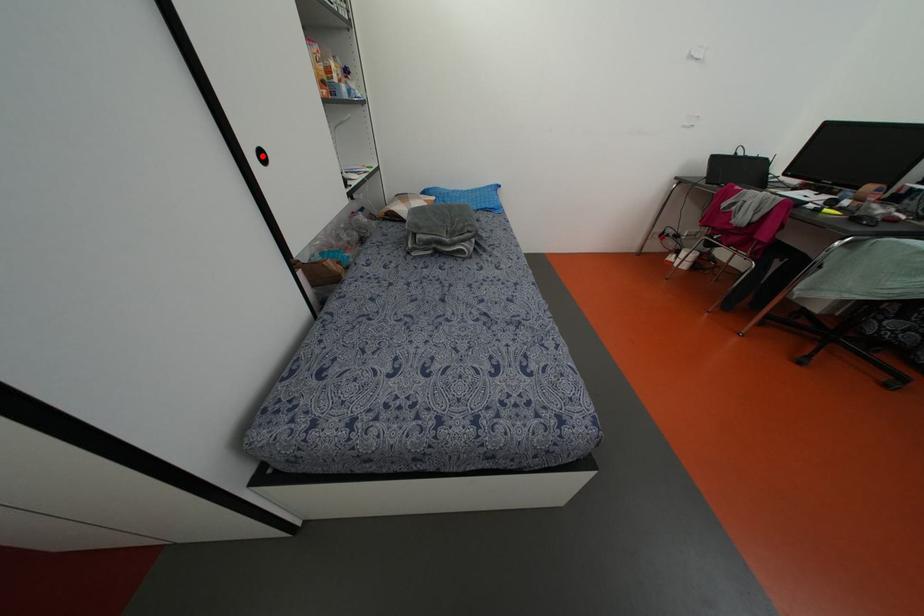
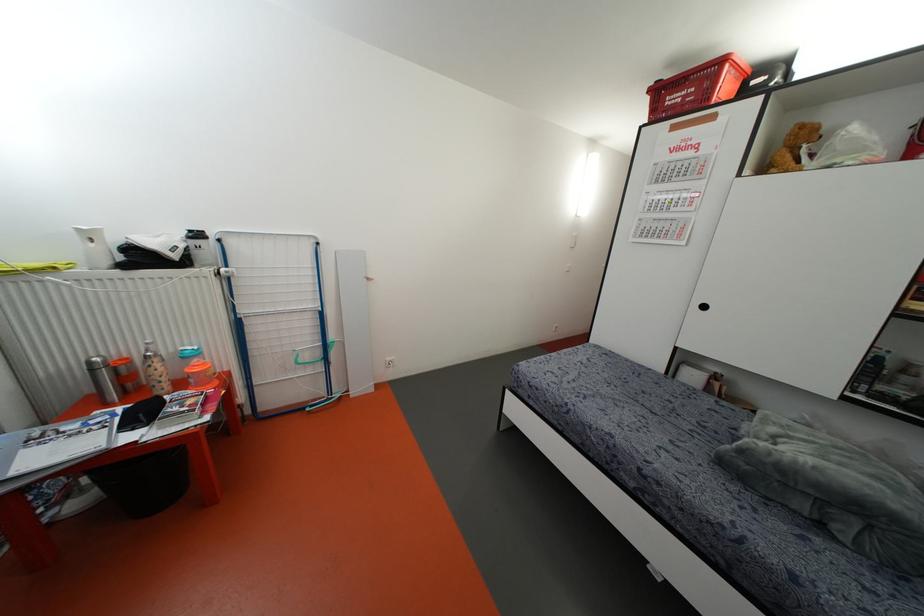
Question: I am providing you with two images of the same scene from different viewpoints. A red point is marked on the first image. At the location where the point appears in image 1, is it still visible in image 2?

Choices:
 (A) Yes
 (B) No

Answer: (A)